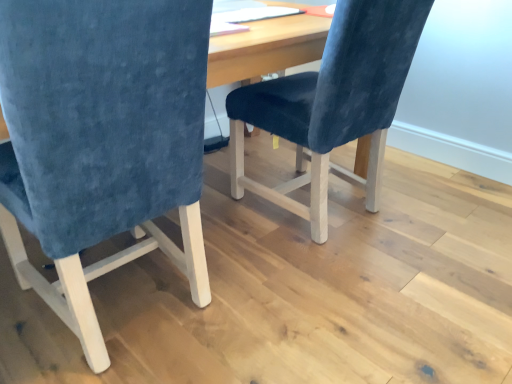
At what (x,y) coordinates should I click in order to perform the action: click on vacant space underneath velvet blue chair at center, which is the 2th chair from left to right (from a real-world perspective). Please return your answer as a coordinate pair (x, y). This screenshot has height=384, width=512. Looking at the image, I should click on point(351,224).